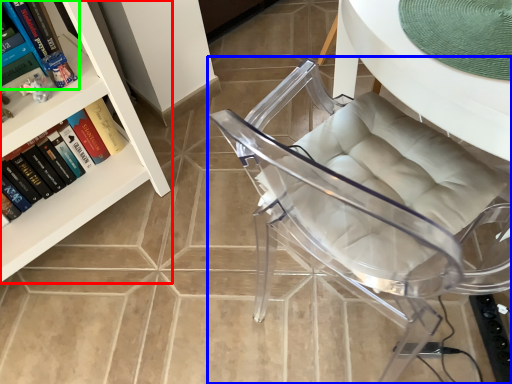
Question: Which object is positioned farthest from bookcase (highlighted by a red box)? Select from chair (highlighted by a blue box) and book (highlighted by a green box).

Choices:
 (A) chair
 (B) book

Answer: (A)